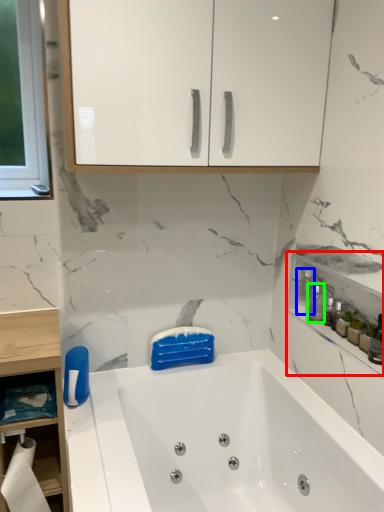
Question: Which object is the closest to the cabinetry (highlighted by a red box)? Choose among these: bottle (highlighted by a blue box) or cleaning product (highlighted by a green box).

Choices:
 (A) bottle
 (B) cleaning product

Answer: (B)